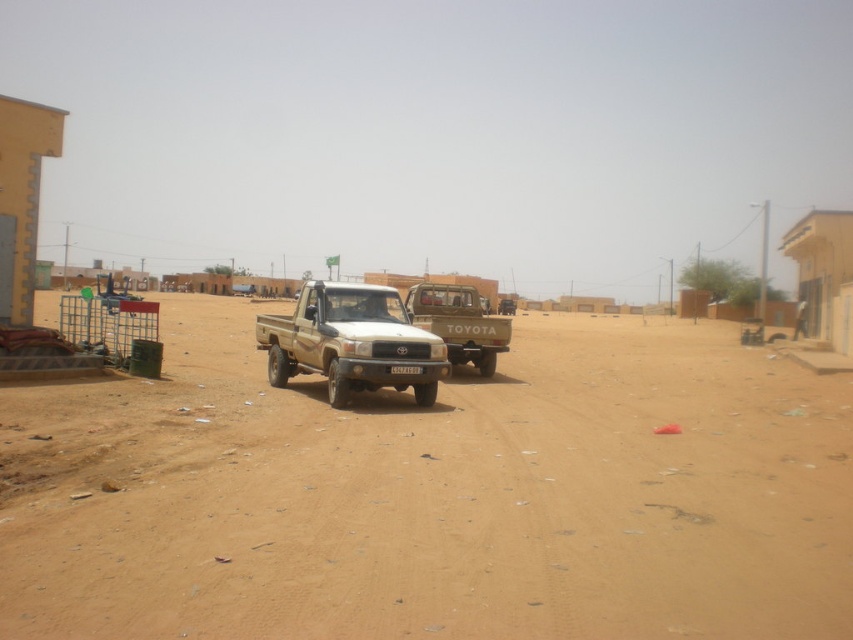
Question: Among these points, which one is nearest to the camera?

Choices:
 (A) (345, 358)
 (B) (409, 296)
 (C) (416, 369)
 (D) (267, 461)

Answer: (D)

Question: Among these points, which one is nearest to the camera?

Choices:
 (A) [421, 369]
 (B) [601, 358]

Answer: (A)

Question: Is brown sandy dirt at center thinner than matte brown truck at center?

Choices:
 (A) no
 (B) yes

Answer: (A)

Question: Does matte beige truck at center have a smaller size compared to black plastic license plate at center?

Choices:
 (A) no
 (B) yes

Answer: (A)

Question: Which point is closer to the camera?

Choices:
 (A) (392, 380)
 (B) (265, 532)
 (C) (409, 368)

Answer: (B)

Question: Can you confirm if matte beige truck at center is wider than matte brown truck at center?

Choices:
 (A) yes
 (B) no

Answer: (B)